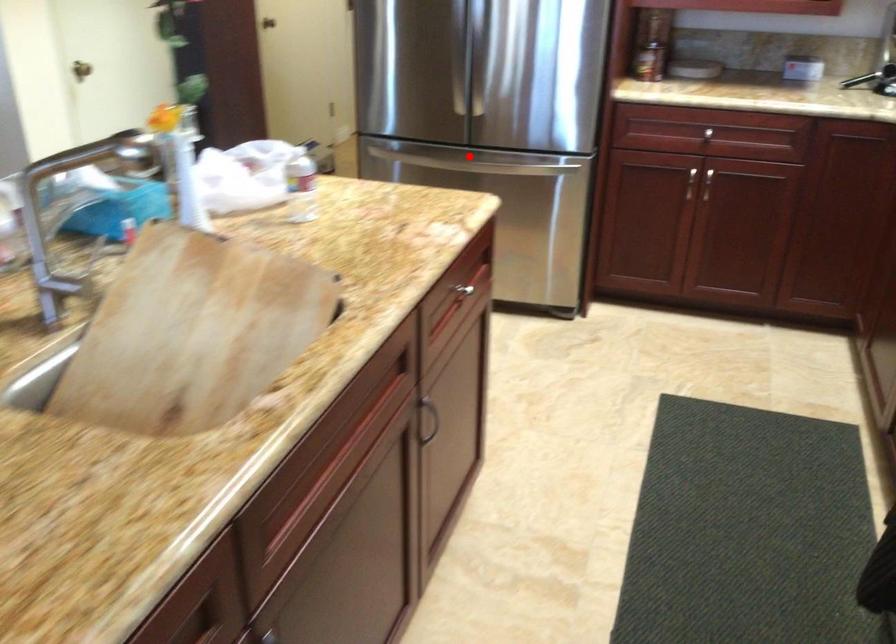
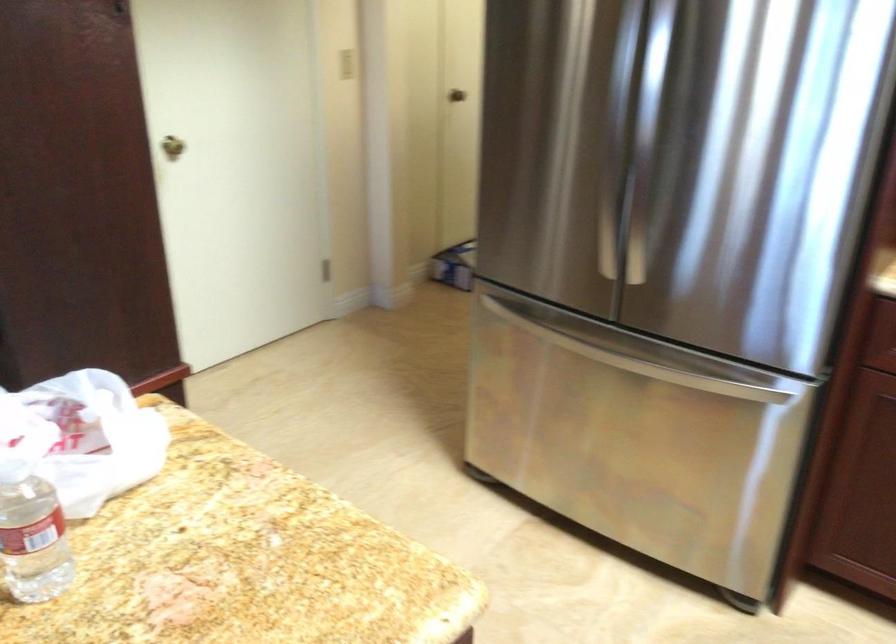
In the second image, find the point that corresponds to the highlighted location in the first image.

(607, 355)